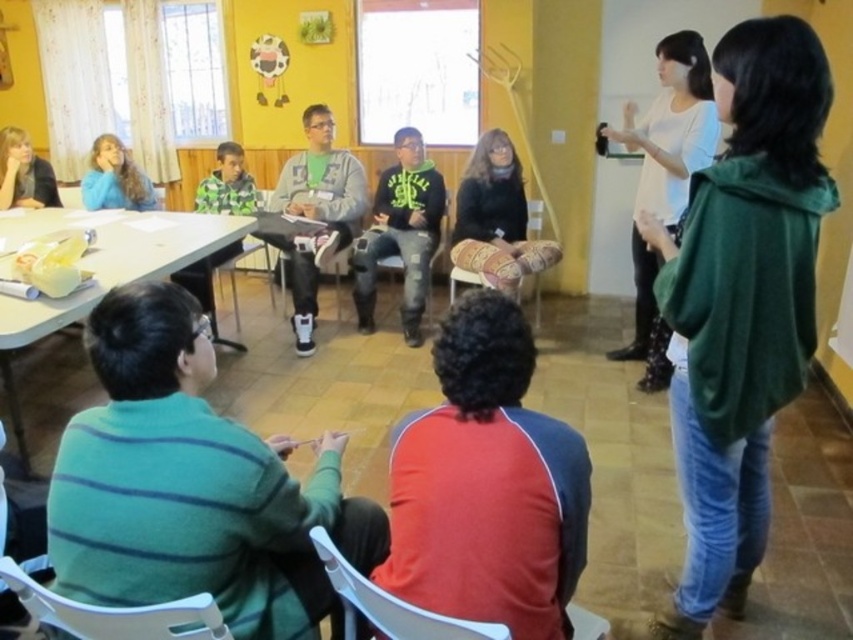
Who is lower down, green matte hoodie at center or white plastic chair at lower left?

Positioned lower is white plastic chair at lower left.

Which is more to the right, green matte hoodie at center or white plastic chair at lower left?

Positioned to the right is green matte hoodie at center.

This screenshot has width=853, height=640. In order to click on green matte hoodie at center in this screenshot , I will do `click(401, 234)`.

The width and height of the screenshot is (853, 640). In order to click on green matte hoodie at center in this screenshot , I will do `click(401, 234)`.

Can you confirm if gray fleece jacket at center is thinner than patterned fabric cushion at center?

In fact, gray fleece jacket at center might be wider than patterned fabric cushion at center.

Who is positioned more to the right, gray fleece jacket at center or patterned fabric cushion at center?

From the viewer's perspective, patterned fabric cushion at center appears more on the right side.

I want to click on gray fleece jacket at center, so click(x=318, y=211).

Is black sweater at center shorter than blue fleece jacket at upper left?

No, black sweater at center is not shorter than blue fleece jacket at upper left.

Between black sweater at center and blue fleece jacket at upper left, which one has more height?

black sweater at center is taller.

Who is more distant from viewer, (x=482, y=140) or (x=143, y=200)?

The point (x=143, y=200) is behind.

The image size is (853, 640). What are the coordinates of `black sweater at center` in the screenshot? It's located at (498, 211).